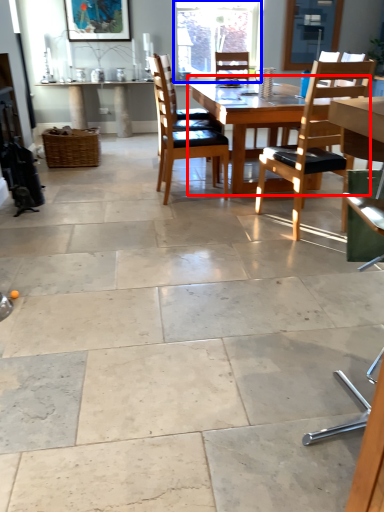
Question: Which point is further to the camera, kitchen & dining room table (highlighted by a red box) or window (highlighted by a blue box)?

Choices:
 (A) kitchen & dining room table
 (B) window

Answer: (B)